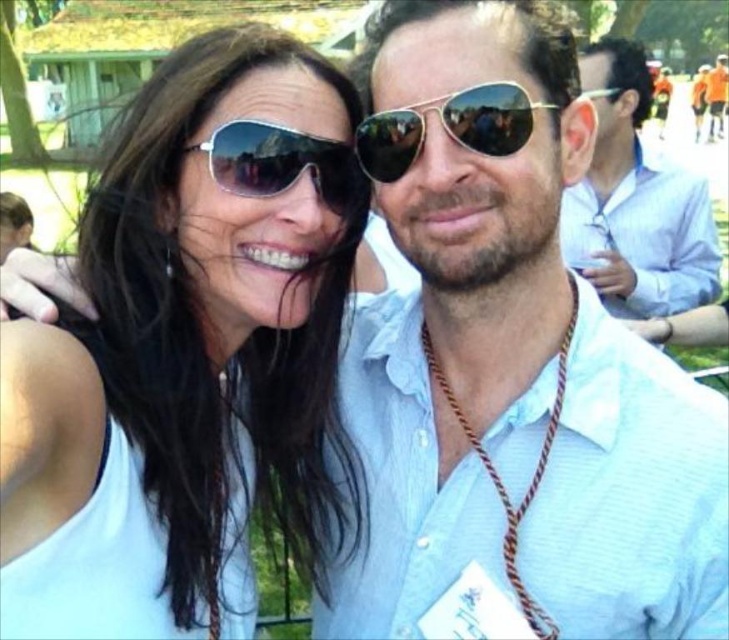
In the scene shown: Which of these two, sunglasses at center or gold reflective aviator sunglasses at center, stands taller?

With more height is gold reflective aviator sunglasses at center.

The height and width of the screenshot is (640, 729). What do you see at coordinates (284, 164) in the screenshot? I see `sunglasses at center` at bounding box center [284, 164].

Between point (346, 176) and point (370, 141), which one is positioned behind?

The point (346, 176) is more distant.

Identify the location of sunglasses at center. The image size is (729, 640). (284, 164).

Can you confirm if matte white tank top at center is thinner than light blue shirt at right?

Yes, matte white tank top at center is thinner than light blue shirt at right.

Can you confirm if matte white tank top at center is smaller than light blue shirt at right?

Indeed, matte white tank top at center has a smaller size compared to light blue shirt at right.

Is point (292, 340) positioned before point (604, 291)?

Yes, it is.

This screenshot has width=729, height=640. Find the location of `matte white tank top at center`. matte white tank top at center is located at coordinates (187, 355).

Is matte white tank top at center smaller than matte orange shirt at upper right?

Indeed, matte white tank top at center has a smaller size compared to matte orange shirt at upper right.

Which is behind, point (141, 339) or point (709, 132)?

Point (709, 132)

Where is `matte white tank top at center`? matte white tank top at center is located at coordinates (187, 355).